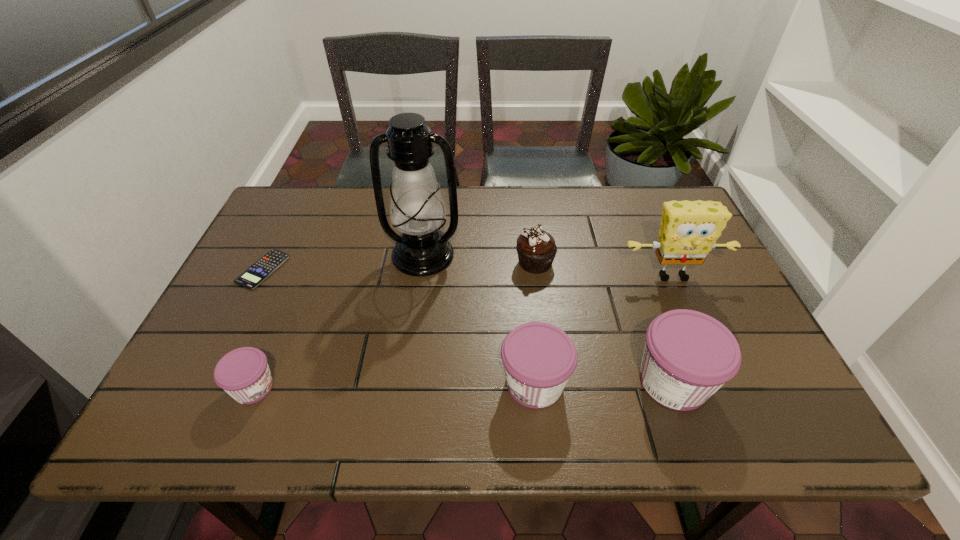
If we want them evenly spaced by inserting an extra jam among them, please locate a free spot for this new jam. Please provide its 2D coordinates. Your answer should be formatted as a tuple, i.e. [(x, y)], where the tuple contains the x and y coordinates of a point satisfying the conditions above.

[(395, 386)]